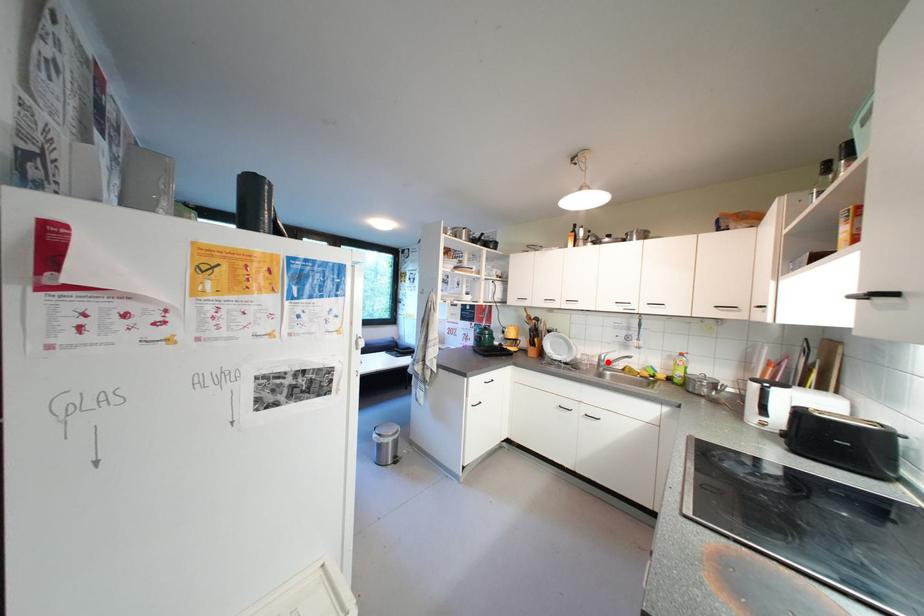
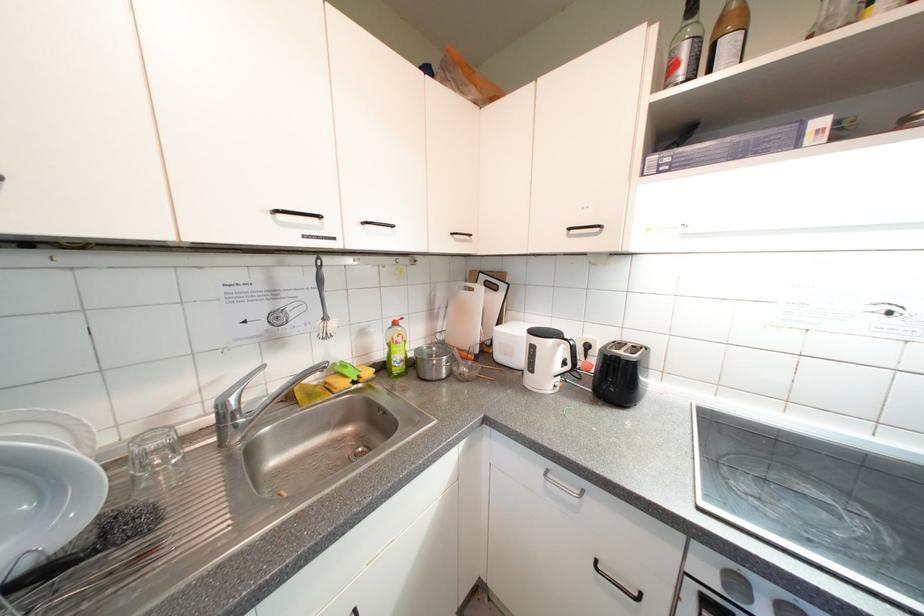
Question: A red point is marked in image1. In image2, is the corresponding 3D point closer to the camera or farther? Reply with the corresponding letter.

Choices:
 (A) The corresponding 3D point is closer.
 (B) The corresponding 3D point is farther.

Answer: (A)